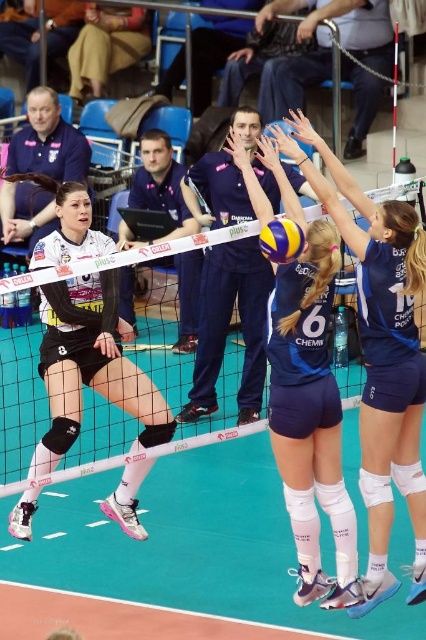
How distant is blue fabric volleyball at center from yellow matte volleyball at center?

The distance of blue fabric volleyball at center from yellow matte volleyball at center is 22.91 inches.

Which is below, blue fabric volleyball at center or yellow matte volleyball at center?

blue fabric volleyball at center

Identify the location of blue fabric volleyball at center. (308, 403).

This screenshot has height=640, width=426. In order to click on blue fabric volleyball at center in this screenshot , I will do tap(308, 403).

Can you confirm if white mesh net at center is wider than blue fabric shorts at center?

No.

Which is below, white mesh net at center or blue fabric shorts at center?

Positioned lower is white mesh net at center.

Identify the location of white mesh net at center. (103, 408).

The height and width of the screenshot is (640, 426). Find the location of `white mesh net at center`. white mesh net at center is located at coordinates (103, 408).

Is point (106, 248) positioned before point (293, 259)?

No, (106, 248) is further to viewer.

Which is behind, point (83, 250) or point (281, 227)?

Positioned behind is point (83, 250).

Where is `matte black uniform at center`? The image size is (426, 640). matte black uniform at center is located at coordinates (89, 365).